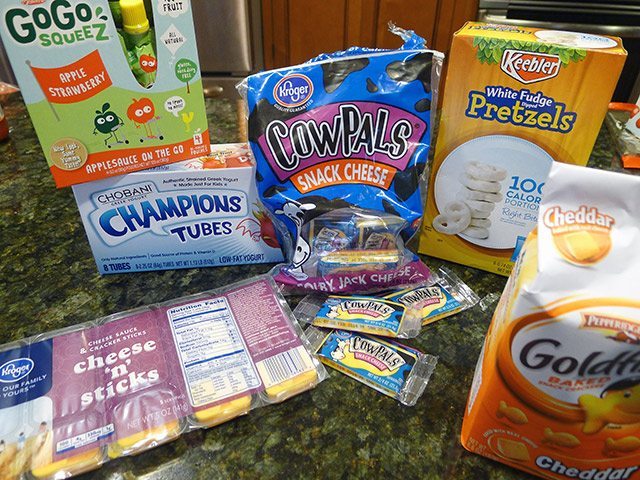
Where is `cabinet`? The width and height of the screenshot is (640, 480). cabinet is located at coordinates (386, 6).